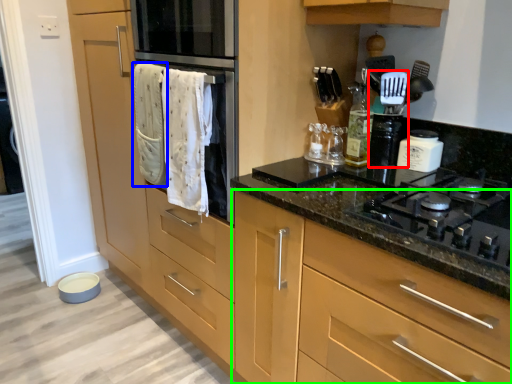
Question: Which is farther away from appliance (highlighted by a red box)? bath towel (highlighted by a blue box) or cabinetry (highlighted by a green box)?

Choices:
 (A) bath towel
 (B) cabinetry

Answer: (A)